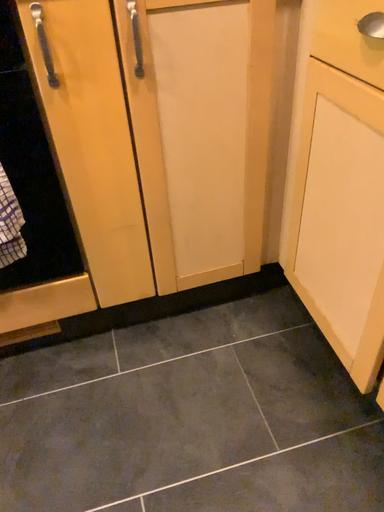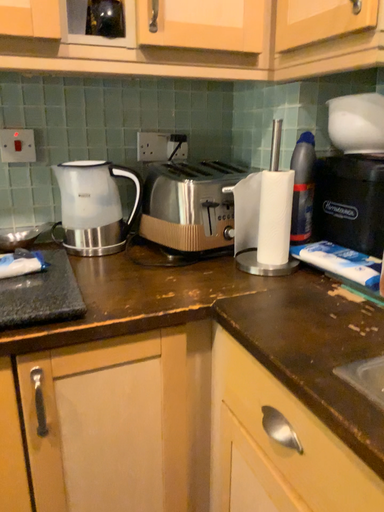
Question: How did the camera likely rotate when shooting the video?

Choices:
 (A) rotated right
 (B) rotated left

Answer: (A)